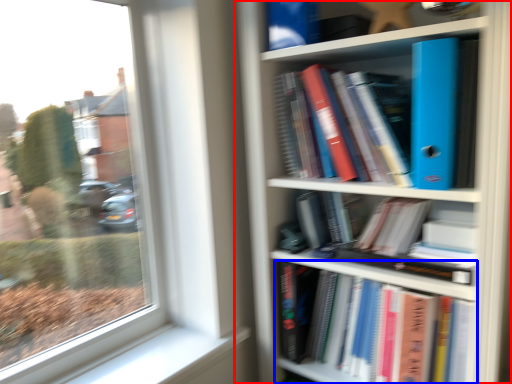
Question: Among these objects, which one is farthest to the camera, bookcase (highlighted by a red box) or book (highlighted by a blue box)?

Choices:
 (A) bookcase
 (B) book

Answer: (B)